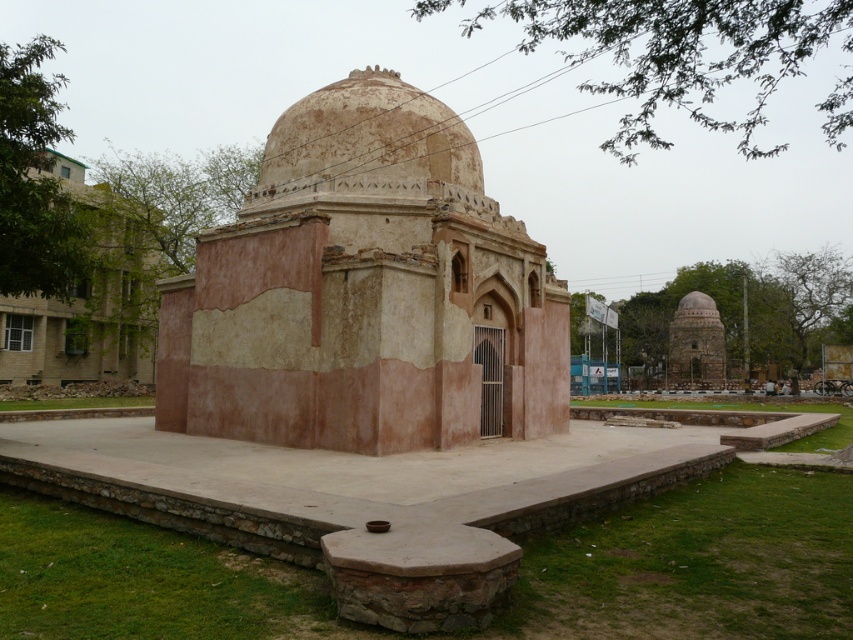
From the picture: You are standing on the paved platform around the tomb and want to compare the two domes in the scene. Which dome, the rustic stone dome at center or the brown textured dome at center, has a greater height?

The rustic stone dome at center is taller than the brown textured dome at center.

You are an architect examining two domes in an ancient tomb structure. The scene includes a rustic stone dome at center and a beige stone dome at center. Which dome has a smaller height?

The rustic stone dome at center has a lesser height compared to the beige stone dome at center, so the rustic stone dome at center is smaller in height.

You are an archaeologist examining the ancient tomb. You notice the beige stone dome at center and the brown textured dome at center. Which dome is positioned lower in the structure?

The beige stone dome at center is positioned below the brown textured dome at center, so it is lower in the structure.